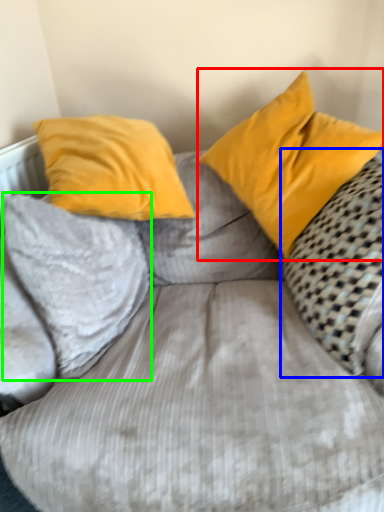
Question: Which object is positioned closest to pillow (highlighted by a red box)? Select from pillow (highlighted by a blue box) and pillow (highlighted by a green box).

Choices:
 (A) pillow
 (B) pillow

Answer: (A)